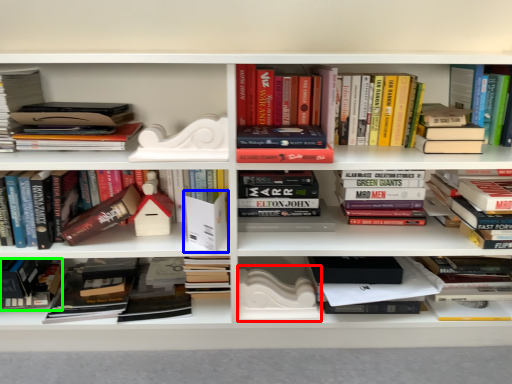
Question: Estimate the real-world distances between objects in this image. Which object is closer to paperback book (highlighted by a red box), paperback book (highlighted by a blue box) or book (highlighted by a green box)?

Choices:
 (A) paperback book
 (B) book

Answer: (A)